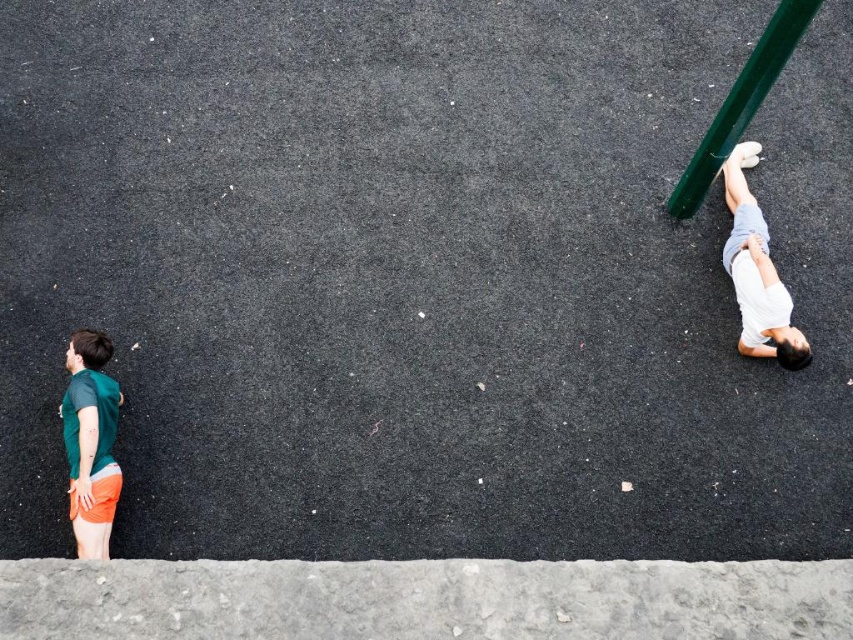
Question: Considering the relative positions of green matte shorts at left and green metallic pole at upper right in the image provided, where is green matte shorts at left located with respect to green metallic pole at upper right?

Choices:
 (A) below
 (B) above

Answer: (A)

Question: Estimate the real-world distances between objects in this image. Which object is closer to the green matte shorts at left?

Choices:
 (A) green metallic pole at upper right
 (B) white cotton shorts at right

Answer: (A)

Question: Which point is closer to the camera?

Choices:
 (A) white cotton shorts at right
 (B) green metallic pole at upper right

Answer: (B)

Question: Is green matte shorts at left thinner than green metallic pole at upper right?

Choices:
 (A) yes
 (B) no

Answer: (A)

Question: Which point appears closest to the camera in this image?

Choices:
 (A) (782, 45)
 (B) (94, 552)

Answer: (A)

Question: Can you confirm if green matte shorts at left is thinner than white cotton shorts at right?

Choices:
 (A) no
 (B) yes

Answer: (A)